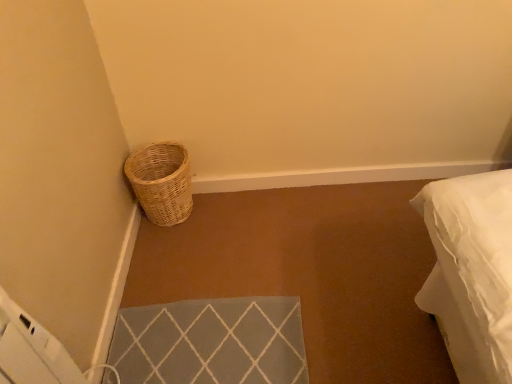
The height and width of the screenshot is (384, 512). What do you see at coordinates (161, 182) in the screenshot?
I see `woven natural basket at lower left` at bounding box center [161, 182].

In order to face woven natural basket at lower left, should I rotate leftwards or rightwards?

You should rotate left by 12.106 degrees.

You are a GUI agent. You are given a task and a screenshot of the screen. Output one action in this format:
    pyautogui.click(x=<x>, y=<y>)
    Task: Click on the woven natural basket at lower left
    
    Given the screenshot: What is the action you would take?
    pyautogui.click(x=161, y=182)

The height and width of the screenshot is (384, 512). Identify the location of woven natural basket at lower left. (161, 182).